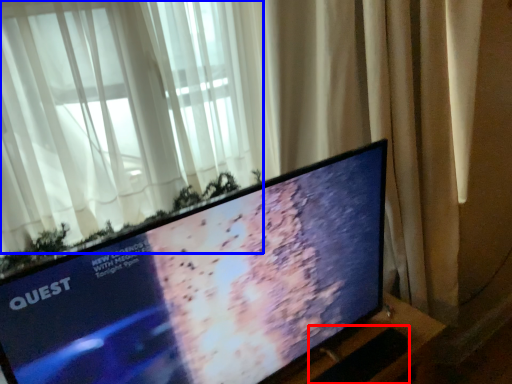
Question: Which of the following is the farthest to the observer, laptop keyboard (highlighted by a red box) or curtain (highlighted by a blue box)?

Choices:
 (A) laptop keyboard
 (B) curtain

Answer: (A)